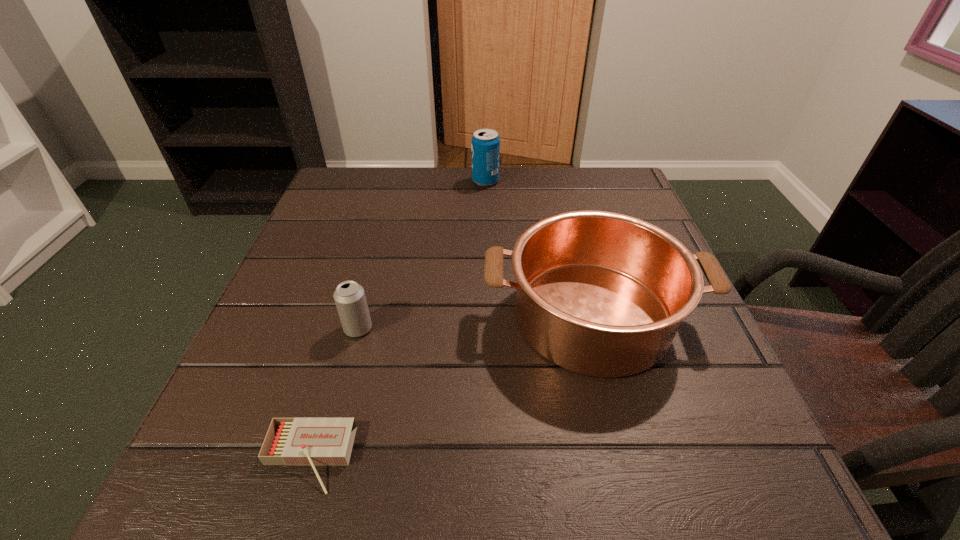
You are a GUI agent. You are given a task and a screenshot of the screen. Output one action in this format:
    pyautogui.click(x=<x>, y=<y>)
    Task: Click on the beer can that is at the left edge
    
    Given the screenshot: What is the action you would take?
    pyautogui.click(x=349, y=296)

Identify the location of matchbox that is at the left edge. This screenshot has width=960, height=540. (289, 441).

At what (x,y) coordinates should I click in order to perform the action: click on object present at the right edge. Please return your answer as a coordinate pair (x, y). Image resolution: width=960 pixels, height=540 pixels. Looking at the image, I should click on (602, 294).

Identify the location of object at the near left corner. (289, 441).

Image resolution: width=960 pixels, height=540 pixels. In the image, there is a desktop. What are the coordinates of `vacant space at the far edge` in the screenshot? It's located at (441, 199).

This screenshot has height=540, width=960. Find the location of `vacant area at the near edge`. vacant area at the near edge is located at coordinates (609, 447).

Find the location of a particular element. The width and height of the screenshot is (960, 540). vacant region at the left edge of the desktop is located at coordinates point(325,273).

Image resolution: width=960 pixels, height=540 pixels. I want to click on vacant region at the right edge of the desktop, so click(x=685, y=359).

Where is `free region at the far right corner of the desktop`? free region at the far right corner of the desktop is located at coordinates (629, 208).

Locate an element on the screen. vacant region at the near right corner of the desktop is located at coordinates (711, 475).